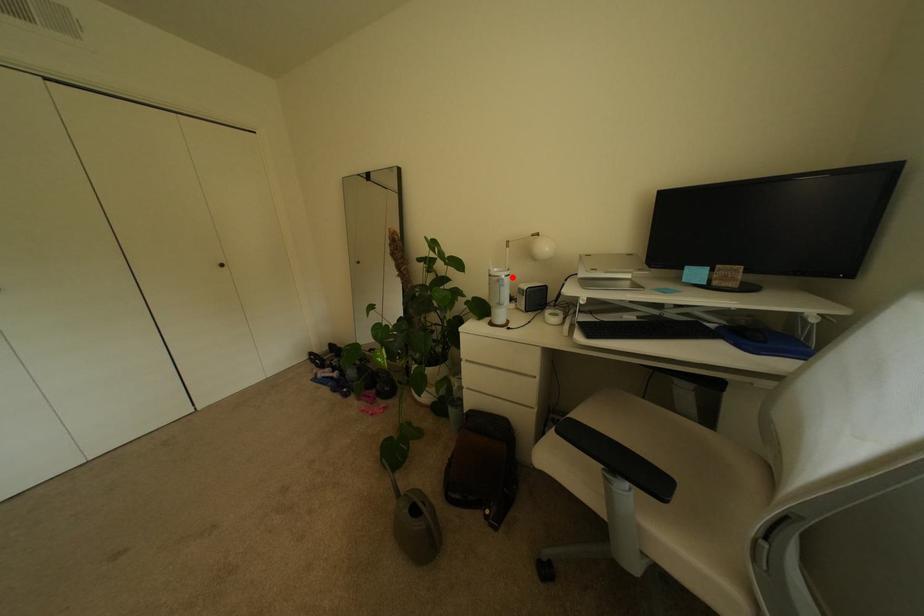
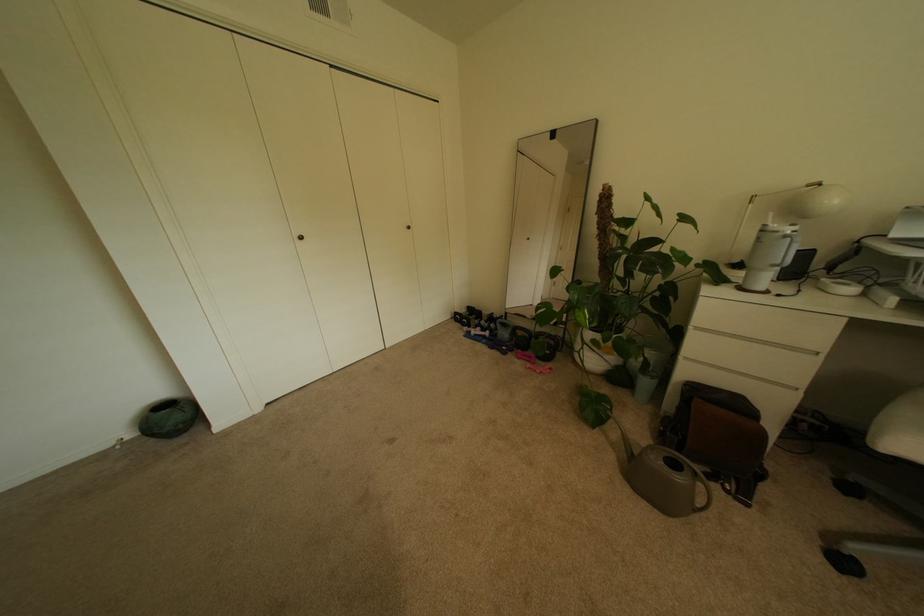
Find the pixel in the second image that matches the highlighted location in the first image.

(796, 233)